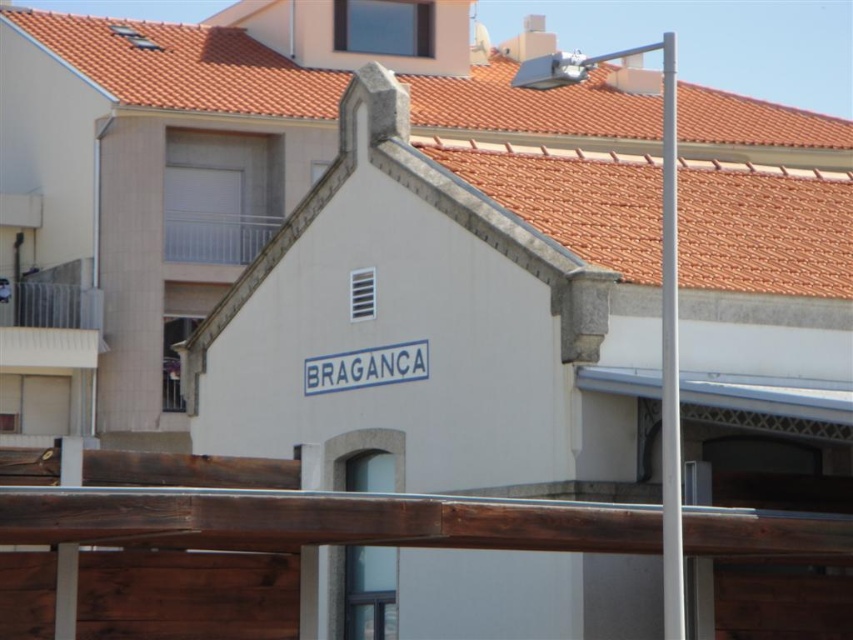
You are a delivery person with a cart that is 1.5 meters wide. You need to navigate between the brown wooden rail at lower center and the white metallic pole at right to reach the entrance of the building. Can your cart fit through the space between them?

The distance between the brown wooden rail at lower center and the white metallic pole at right is 5.12 meters. Since your cart is only 1.5 meters wide, it can easily fit through the space between them.

You are standing at the entrance of the building with the sign BRAGANCA. You need to locate the brown wooden rail at lower center. According to the coordinates provided, where exactly is it positioned?

The brown wooden rail at lower center is positioned at coordinates point [320,518].